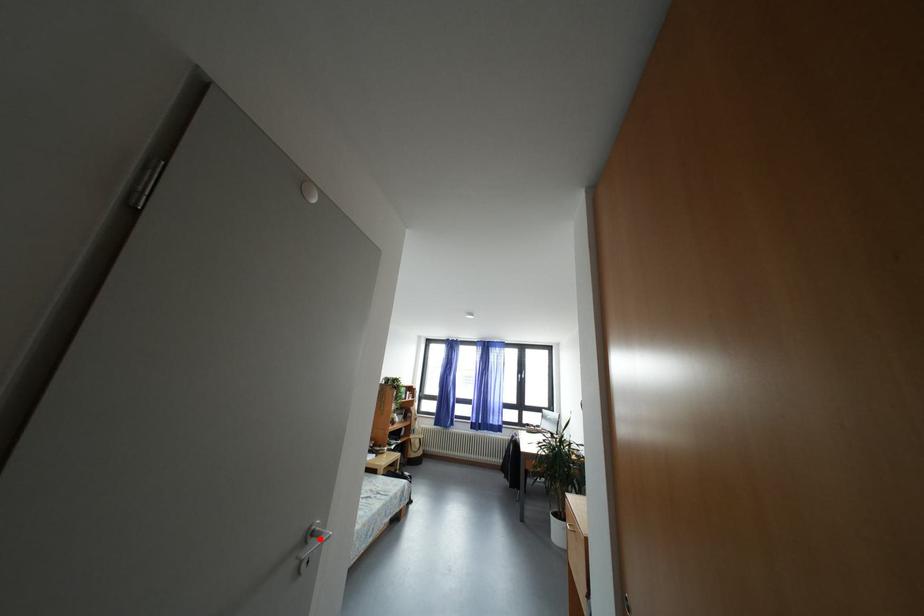
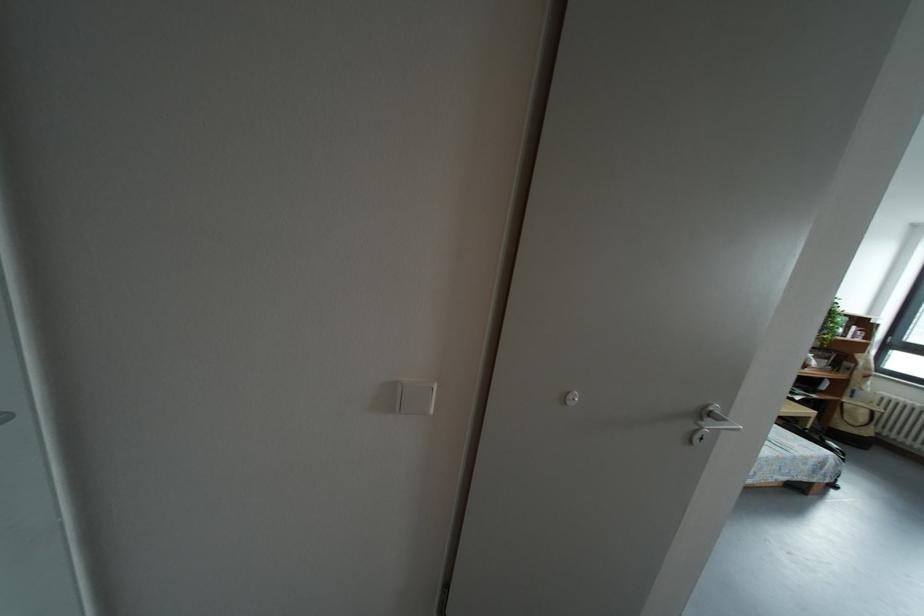
Locate, in the second image, the point that corresponds to the highlighted location in the first image.

(718, 419)